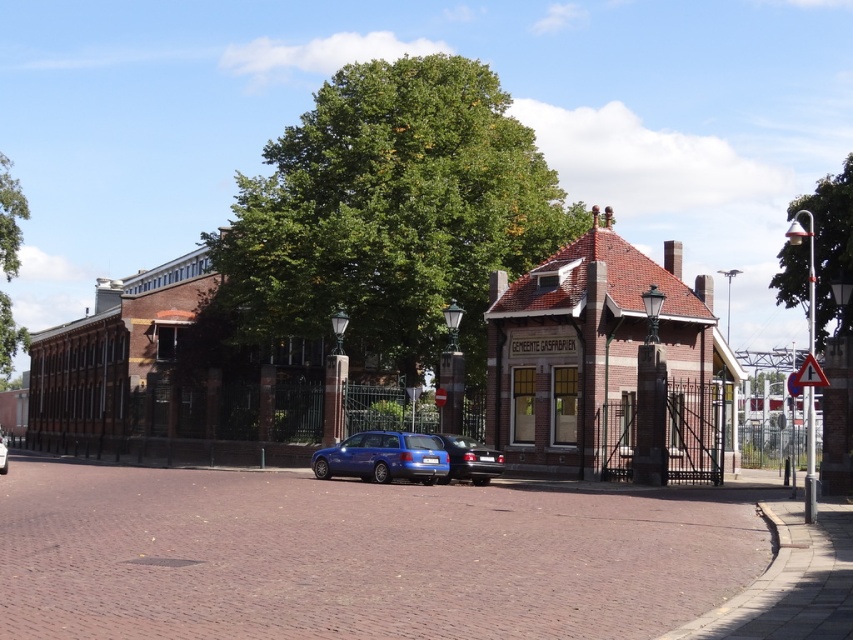
Question: Is green leafy tree at upper right closer to the viewer compared to blue metallic car at center?

Choices:
 (A) no
 (B) yes

Answer: (B)

Question: Does matte blue car at center come behind green leafy tree at left?

Choices:
 (A) no
 (B) yes

Answer: (A)

Question: Which point is closer to the camera taking this photo?

Choices:
 (A) (3, 356)
 (B) (439, 477)

Answer: (B)

Question: Based on their relative distances, which object is farther from the shiny blue sedan at center?

Choices:
 (A) blue metallic car at center
 (B) green leafy tree at center
 (C) green leafy tree at upper right
 (D) matte blue car at center

Answer: (B)

Question: Which of the following is the farthest from the observer?

Choices:
 (A) (1, 440)
 (B) (780, 289)
 (C) (416, 474)

Answer: (B)

Question: In this image, where is green leafy tree at center located relative to blue metallic car at center?

Choices:
 (A) below
 (B) above

Answer: (B)